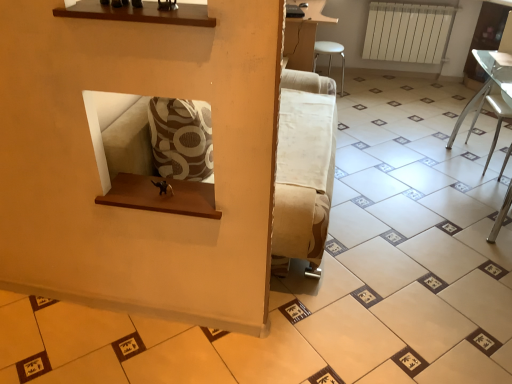
At what (x,y) coordinates should I click in order to perform the action: click on vacant space underneath white matte radiator at upper right (from a real-world perspective). Please return your answer as a coordinate pair (x, y). Looking at the image, I should click on 398,77.